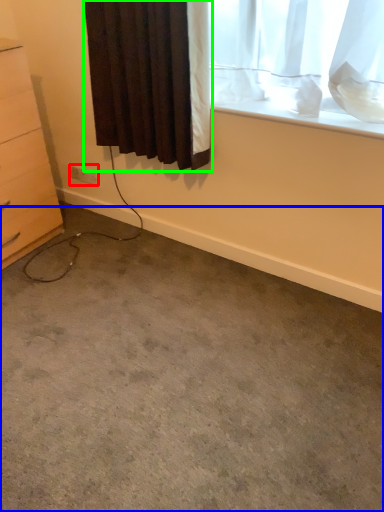
Question: Considering the real-world distances, which object is farthest from electric outlet (highlighted by a red box)? concrete (highlighted by a blue box) or curtain (highlighted by a green box)?

Choices:
 (A) concrete
 (B) curtain

Answer: (A)